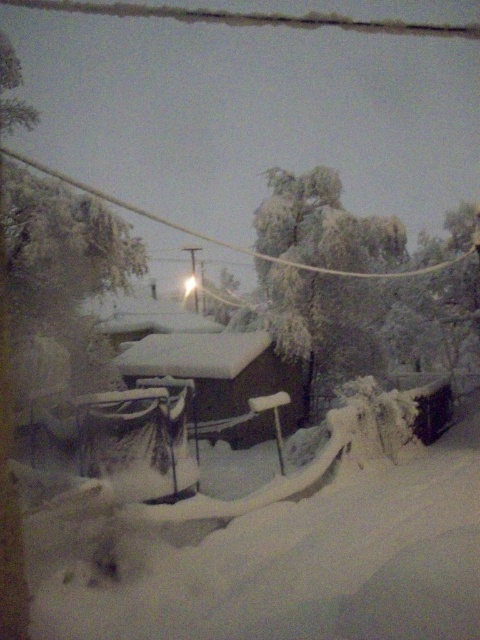
You are standing at the point marked by the coordinates point (324, 275). Looking around, you see a snowy ground and a small wooden cabin. What object is located exactly at your current position?

The frosted green tree at center is located exactly at the point marked by the coordinates point 0.435, 0.675.